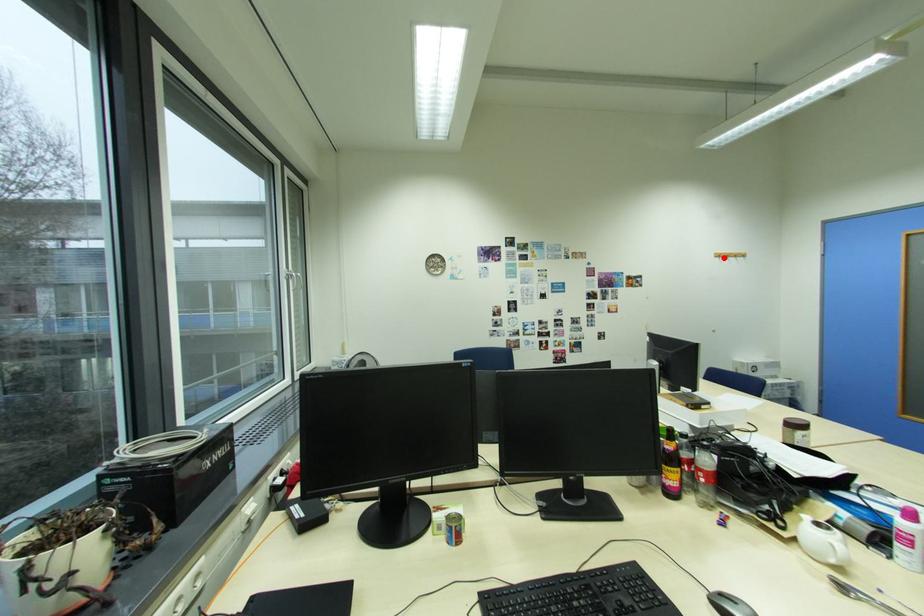
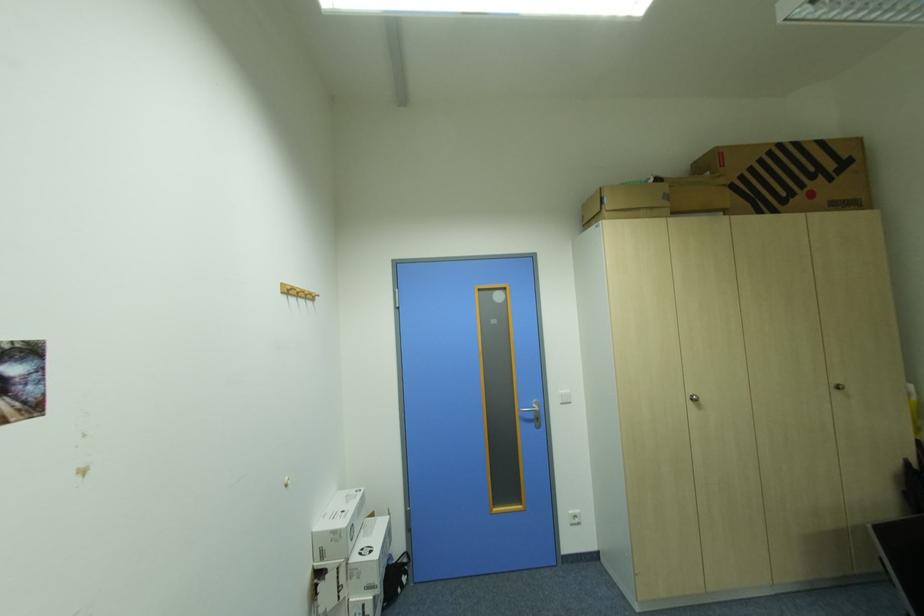
Locate, in the second image, the point that corresponds to the highlighted location in the first image.

(292, 293)